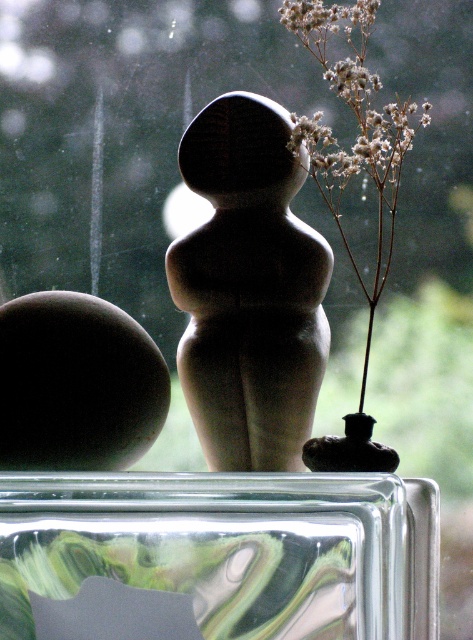
You are an interior designer arranging flowers on a glass table. You have a marbled glass window sill at center and white fluffy flowers at upper right. Which object should you place closer to the edge of the table to ensure stability?

The marbled glass window sill at center should be placed closer to the edge of the table because it is larger and heavier than the white fluffy flowers at upper right, ensuring stability.

You are a photographer trying to capture the marbled glass window sill at center and the white fluffy flowers at upper right in a single shot. Which object will appear larger in your photo?

The marbled glass window sill at center will appear larger in the photo because it is closer to the viewer than the white fluffy flowers at upper right.

You are arranging a vase on the table and need to ensure it doesn not block the view of both the marbled glass window sill at center and the white fluffy flowers at upper right. Which object is taller and needs to be placed where to avoid obstruction?

The white fluffy flowers at upper right are taller than the marbled glass window sill at center. To avoid blocking their view, place the vase in a position where it doesn not obscure the line of sight to the white fluffy flowers at upper right.